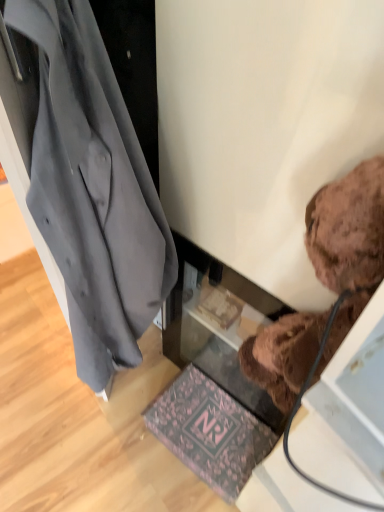
I want to click on vacant area situated below dark gray fabric coat at left (from a real-world perspective), so pyautogui.click(x=134, y=392).